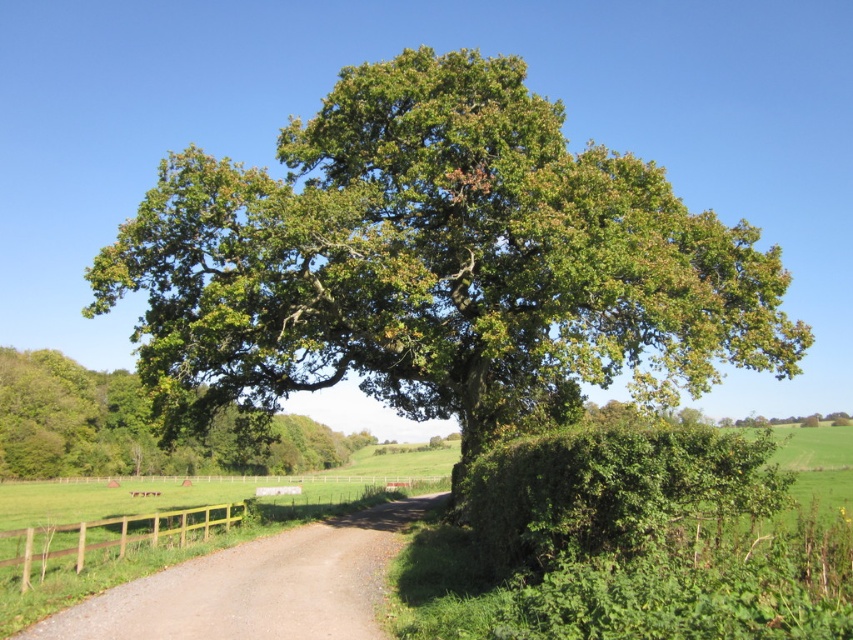
Question: Where is green leafy oak at center located in relation to green leafy tree at center in the image?

Choices:
 (A) above
 (B) below

Answer: (A)

Question: Is green leafy hedge at lower right further to camera compared to dirt road at center?

Choices:
 (A) no
 (B) yes

Answer: (A)

Question: Considering the real-world distances, which object is farthest from the green leafy tree at center?

Choices:
 (A) green leafy hedge at lower right
 (B) dirt road at center
 (C) green leafy oak at center
 (D) brown wooden fence at lower left

Answer: (B)

Question: Is green leafy tree at center positioned at the back of brown wooden fence at lower left?

Choices:
 (A) yes
 (B) no

Answer: (A)

Question: Among these objects, which one is nearest to the camera?

Choices:
 (A) dirt road at center
 (B) green leafy hedge at lower right
 (C) green leafy tree at center
 (D) green leafy oak at center

Answer: (B)

Question: Considering the real-world distances, which object is farthest from the green leafy tree at center?

Choices:
 (A) green leafy hedge at lower right
 (B) dirt road at center

Answer: (B)